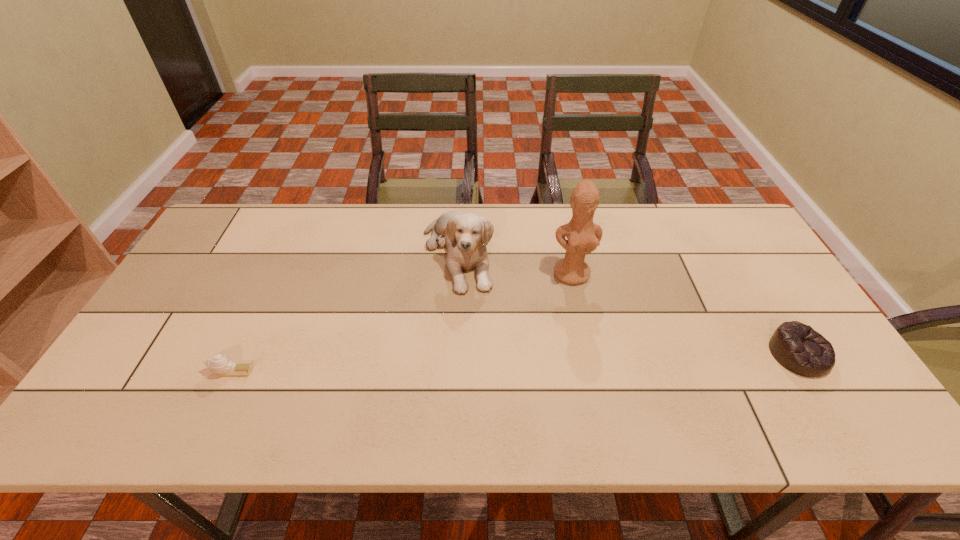
I want to click on vacant spot on the desktop that is between the shortest object and the third tallest object and is positioned on the front-facing side of the second tallest object, so click(517, 362).

Locate an element on the screen. This screenshot has width=960, height=540. free spot on the desktop that is between the leftmost object and the beanbag and is positioned on the front-facing side of the tallest object is located at coordinates (596, 360).